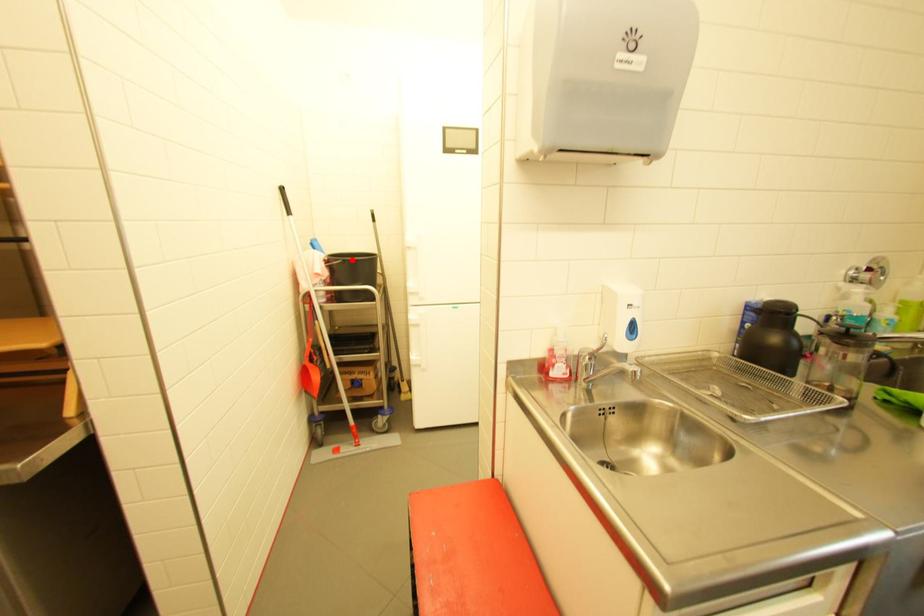
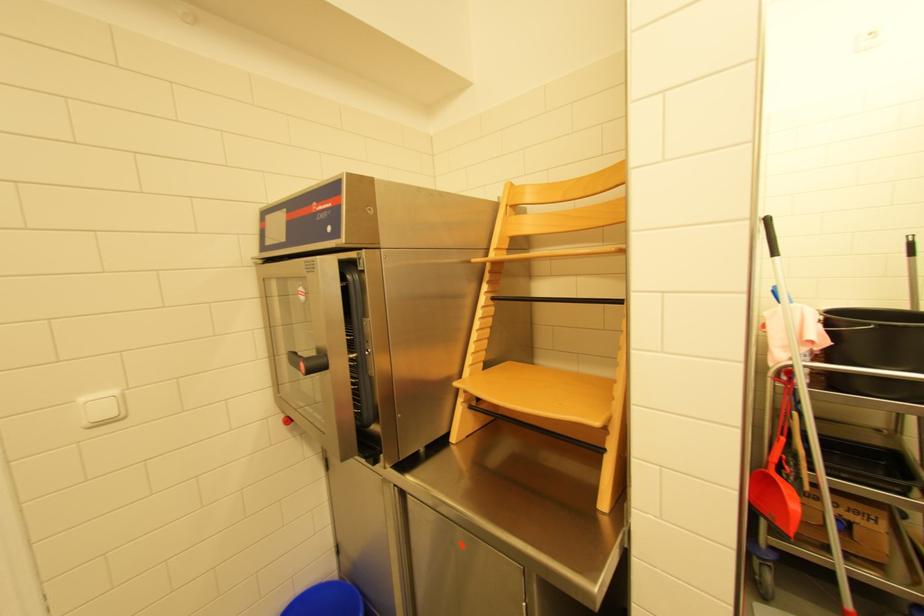
Question: A red point is marked in image1. In image2, is the corresponding 3D point closer to the camera or farther? Reply with the corresponding letter.

Choices:
 (A) The corresponding 3D point is closer.
 (B) The corresponding 3D point is farther.

Answer: (B)